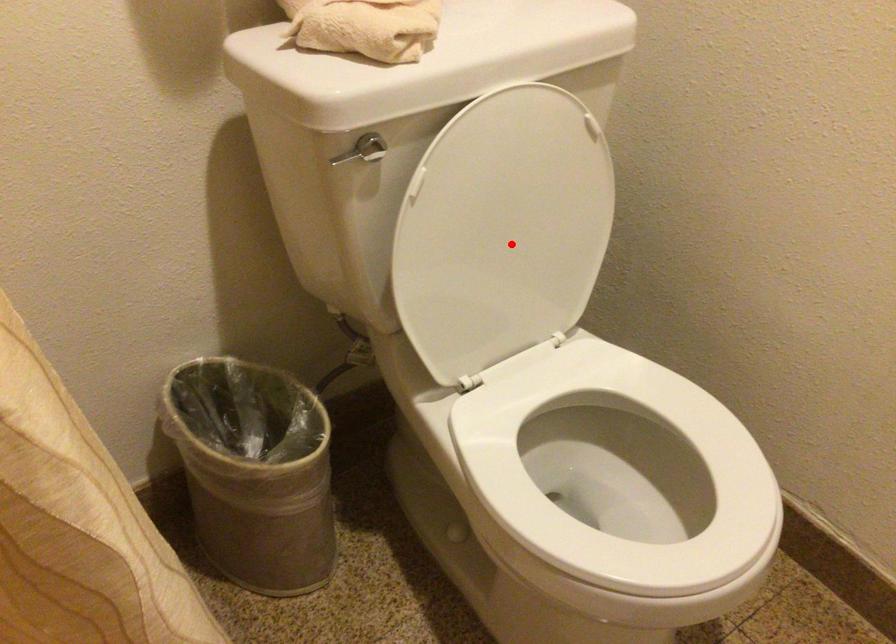
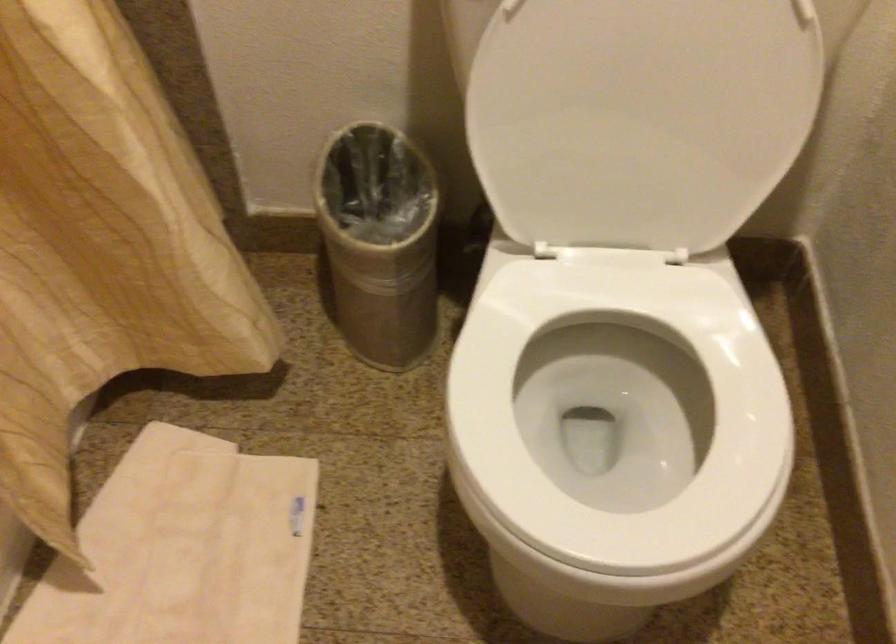
The point at the highlighted location is marked in the first image. Where is the corresponding point in the second image?

(640, 118)